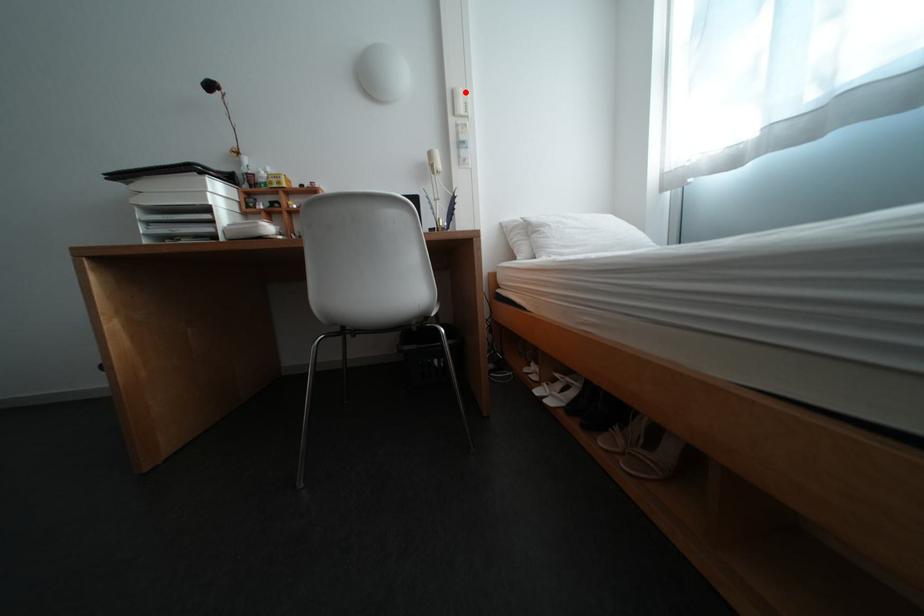
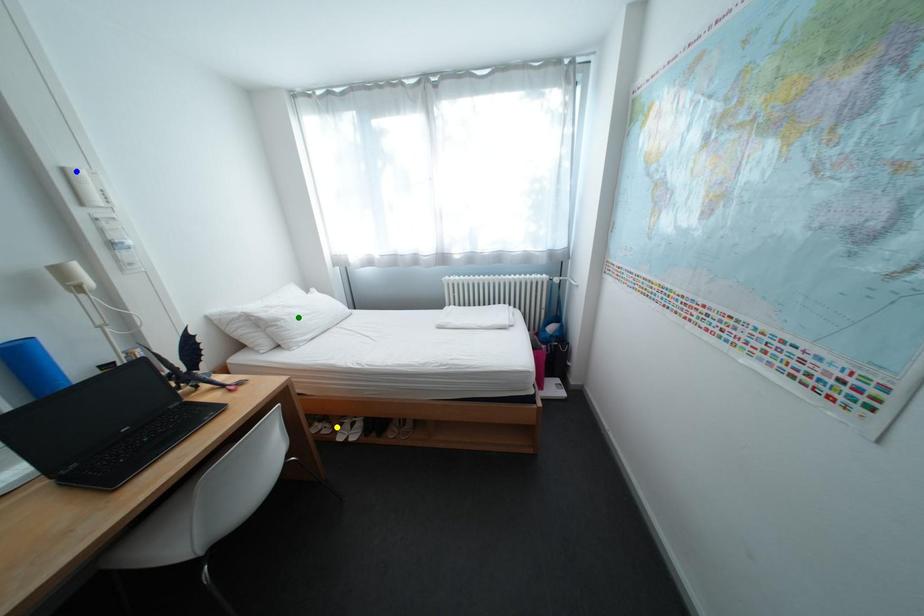
Question: I am providing you with two images of the same scene from different viewpoints. A red point is marked on the first image. You are given multiple points on the second image. In image 2, which mark is for the same physical point as the one in image 1?

Choices:
 (A) green point
 (B) blue point
 (C) yellow point

Answer: (B)